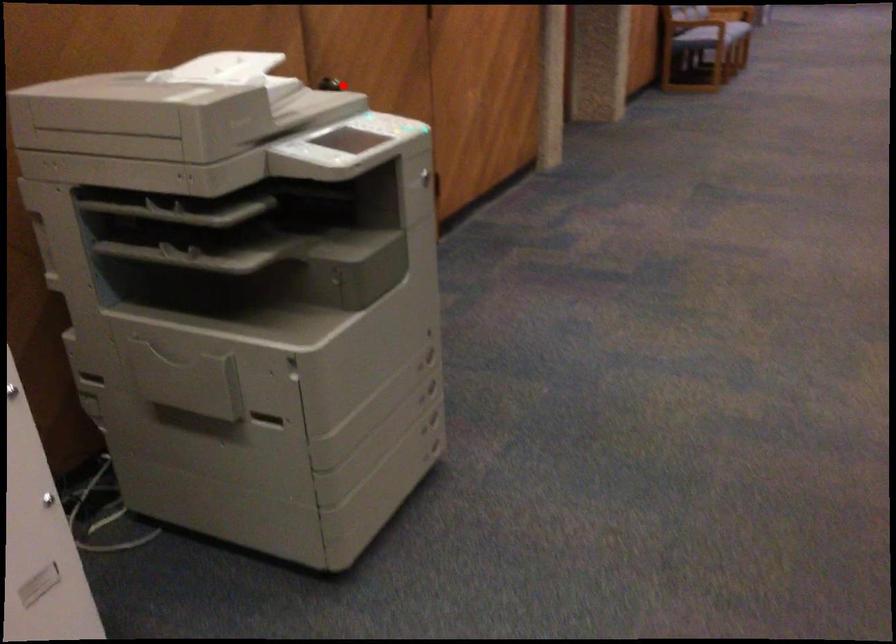
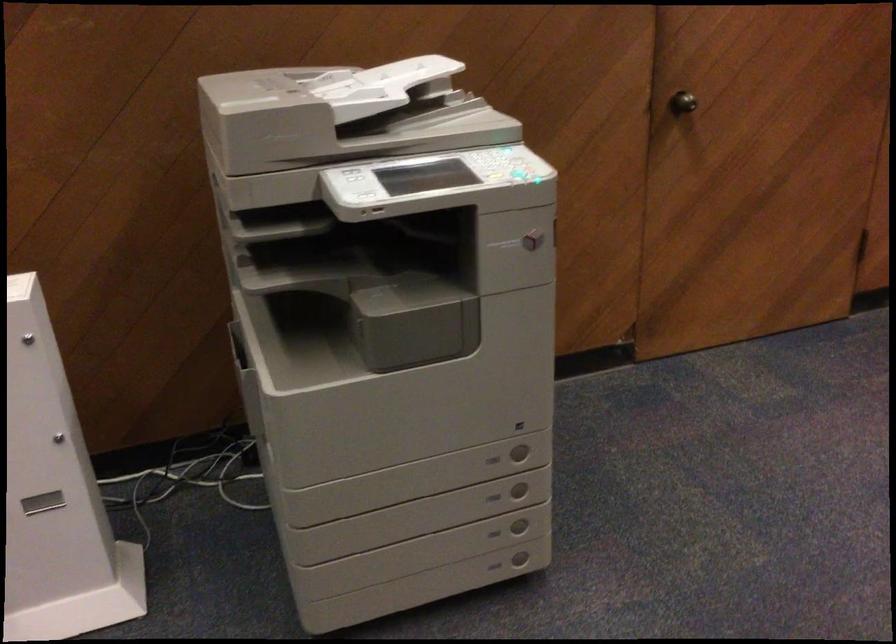
The point at the highlighted location is marked in the first image. Where is the corresponding point in the second image?

(682, 102)